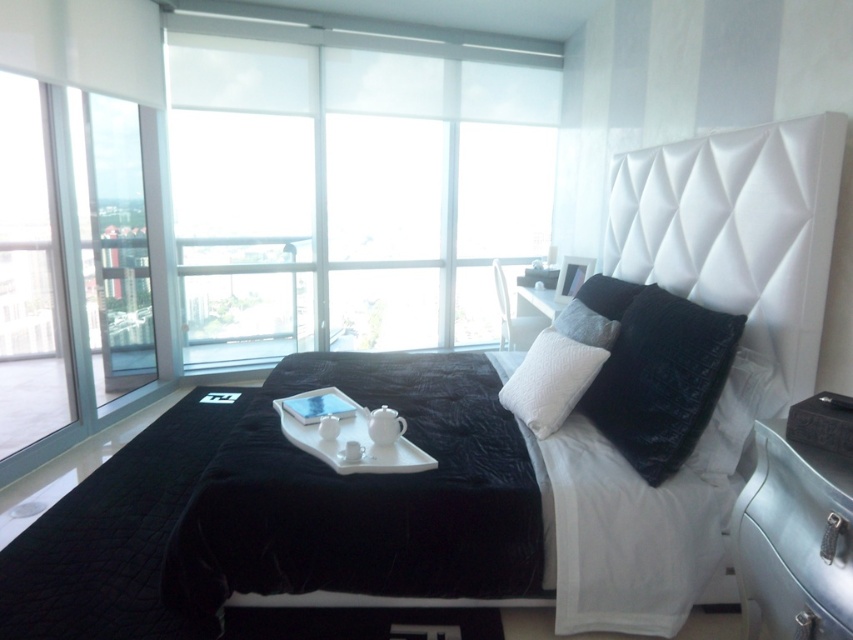
Question: Which of the following is the farthest from the observer?

Choices:
 (A) transparent plastic window at upper center
 (B) transparent glass window at left
 (C) white glossy tray at center

Answer: (A)

Question: Can you confirm if black velvet pillow at center is positioned above transparent glass door at left?

Choices:
 (A) yes
 (B) no

Answer: (B)

Question: Which object is closer to the camera taking this photo?

Choices:
 (A) white textured headboard at upper right
 (B) metallic silver dresser at lower right
 (C) white glossy tray at center

Answer: (B)

Question: Is the position of velvet black bed at center less distant than that of metallic silver dresser at lower right?

Choices:
 (A) yes
 (B) no

Answer: (B)

Question: Is velvet black blanket at center wider than metallic silver dresser at lower right?

Choices:
 (A) yes
 (B) no

Answer: (A)

Question: Which object is the farthest from the white glossy tray at center?

Choices:
 (A) metallic silver dresser at lower right
 (B) transparent glass window at left
 (C) velvet black bed at center
 (D) black velvet pillow at center

Answer: (B)